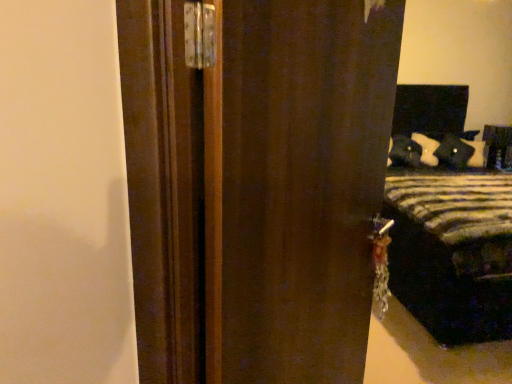
Question: From the image's perspective, does dark wood door at center appear higher than striped fabric bed at right?

Choices:
 (A) no
 (B) yes

Answer: (A)

Question: Does dark wood door at center have a larger size compared to striped fabric bed at right?

Choices:
 (A) yes
 (B) no

Answer: (B)

Question: Is dark wood door at center further to the viewer compared to striped fabric bed at right?

Choices:
 (A) yes
 (B) no

Answer: (B)

Question: Can you confirm if dark wood door at center is wider than striped fabric bed at right?

Choices:
 (A) no
 (B) yes

Answer: (A)

Question: Does dark wood door at center have a lesser height compared to striped fabric bed at right?

Choices:
 (A) yes
 (B) no

Answer: (B)

Question: Does dark wood door at center have a smaller size compared to striped fabric bed at right?

Choices:
 (A) yes
 (B) no

Answer: (A)

Question: Is matte black pillow at upper right a part of dark wood door at center?

Choices:
 (A) no
 (B) yes

Answer: (A)

Question: Is dark wood door at center behind matte black pillow at upper right?

Choices:
 (A) no
 (B) yes

Answer: (A)

Question: From the image's perspective, is dark wood door at center over matte black pillow at upper right?

Choices:
 (A) no
 (B) yes

Answer: (A)

Question: Considering the relative sizes of dark wood door at center and matte black pillow at upper right in the image provided, is dark wood door at center thinner than matte black pillow at upper right?

Choices:
 (A) yes
 (B) no

Answer: (A)

Question: Is dark wood door at center positioned beyond the bounds of matte black pillow at upper right?

Choices:
 (A) no
 (B) yes

Answer: (B)

Question: Is dark wood door at center closer to camera compared to matte black pillow at upper right?

Choices:
 (A) yes
 (B) no

Answer: (A)

Question: Does velvet black pillow at right have a larger size compared to striped fabric bed at right?

Choices:
 (A) yes
 (B) no

Answer: (B)